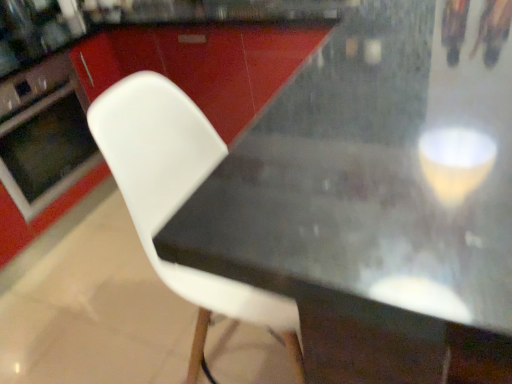
Question: Does matte black oven at left have a greater height compared to white plastic chair at center?

Choices:
 (A) no
 (B) yes

Answer: (A)

Question: Is white plastic chair at center surrounded by matte black oven at left?

Choices:
 (A) yes
 (B) no

Answer: (B)

Question: Considering the relative sizes of matte black oven at left and white plastic chair at center in the image provided, is matte black oven at left wider than white plastic chair at center?

Choices:
 (A) no
 (B) yes

Answer: (B)

Question: Is matte black oven at left positioned far away from white plastic chair at center?

Choices:
 (A) no
 (B) yes

Answer: (B)

Question: Is matte black oven at left thinner than white plastic chair at center?

Choices:
 (A) no
 (B) yes

Answer: (A)

Question: From the image's perspective, would you say matte black oven at left is shown under white plastic chair at center?

Choices:
 (A) no
 (B) yes

Answer: (A)

Question: Is white plastic chair at center at the right side of black matte table at center?

Choices:
 (A) yes
 (B) no

Answer: (B)

Question: From a real-world perspective, does white plastic chair at center sit lower than black matte table at center?

Choices:
 (A) yes
 (B) no

Answer: (A)

Question: From a real-world perspective, is white plastic chair at center positioned over black matte table at center based on gravity?

Choices:
 (A) no
 (B) yes

Answer: (A)

Question: Considering the relative sizes of white plastic chair at center and black matte table at center in the image provided, is white plastic chair at center shorter than black matte table at center?

Choices:
 (A) yes
 (B) no

Answer: (B)

Question: From the image's perspective, is white plastic chair at center on top of black matte table at center?

Choices:
 (A) no
 (B) yes

Answer: (A)

Question: From the image's perspective, is white plastic chair at center beneath black matte table at center?

Choices:
 (A) yes
 (B) no

Answer: (A)

Question: Is white plastic chair at center at the left side of matte black oven at left?

Choices:
 (A) no
 (B) yes

Answer: (A)